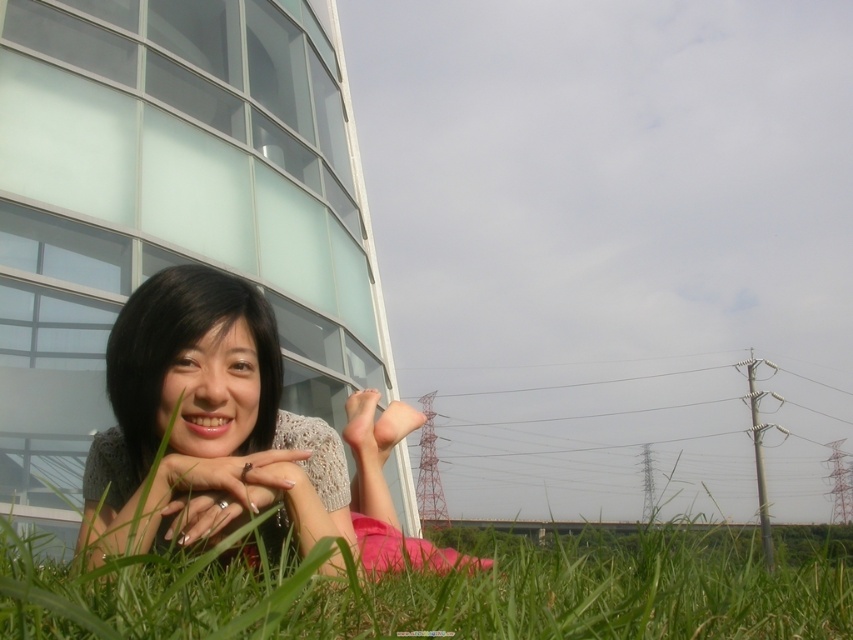
You are standing at the point labeled point (508, 614) and want to toss a ball to a friend who is 36.72 inches away from you. If the maximum distance you can throw is 40 inches, will you be able to reach them?

Yes, because the distance between you and your friend is 36.72 inches, which is within your 40 inches throwing range.